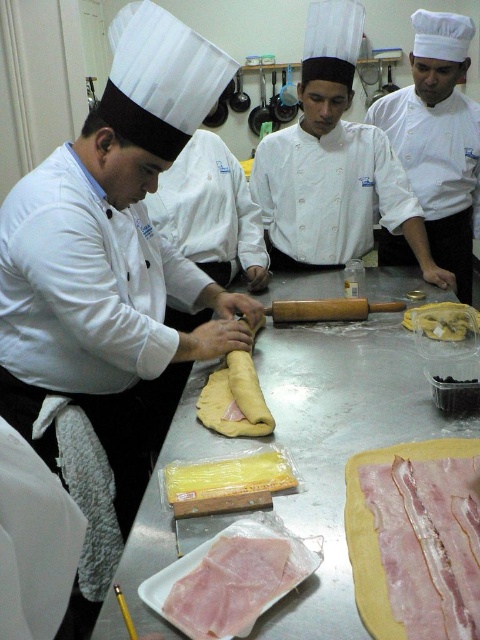
Question: Does yellow matte dough at center come in front of wooden rolling pin at center?

Choices:
 (A) yes
 (B) no

Answer: (A)

Question: Does white matte chef hat at upper right appear on the right side of yellow matte dough at center?

Choices:
 (A) yes
 (B) no

Answer: (A)

Question: Among these objects, which one is nearest to the camera?

Choices:
 (A) pink glossy bacon at center
 (B) pink glossy meat at center
 (C) yellow matte dough at center
 (D) wooden rolling pin at center

Answer: (A)

Question: Which of the following is the farthest from the observer?

Choices:
 (A) white matte chef hat at upper right
 (B) pink glossy bacon at center

Answer: (A)

Question: Does white matte chef hat at upper right appear under wooden rolling pin at center?

Choices:
 (A) no
 (B) yes

Answer: (A)

Question: Which point is farther from the camera taking this photo?

Choices:
 (A) pyautogui.click(x=274, y=566)
 (B) pyautogui.click(x=442, y=324)
 (C) pyautogui.click(x=249, y=364)

Answer: (B)